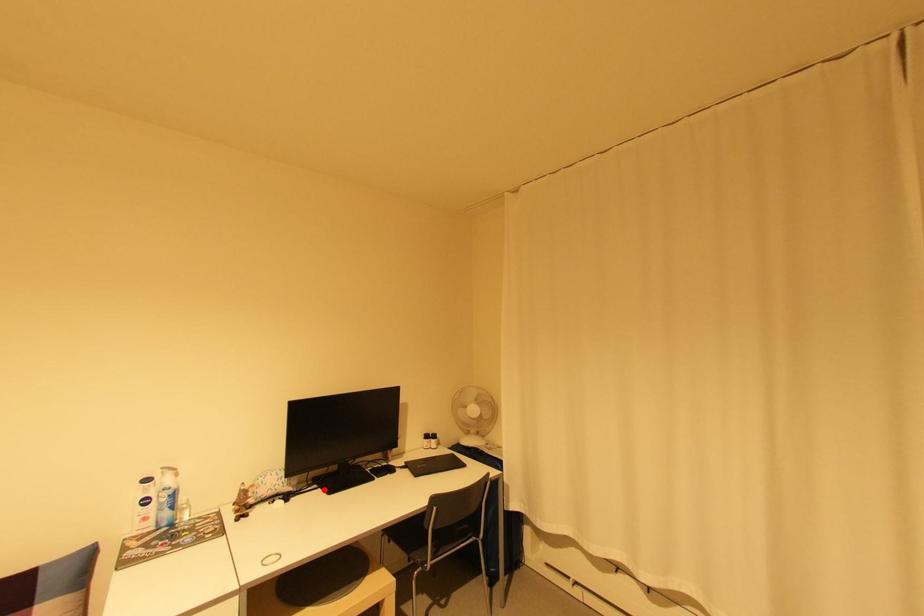
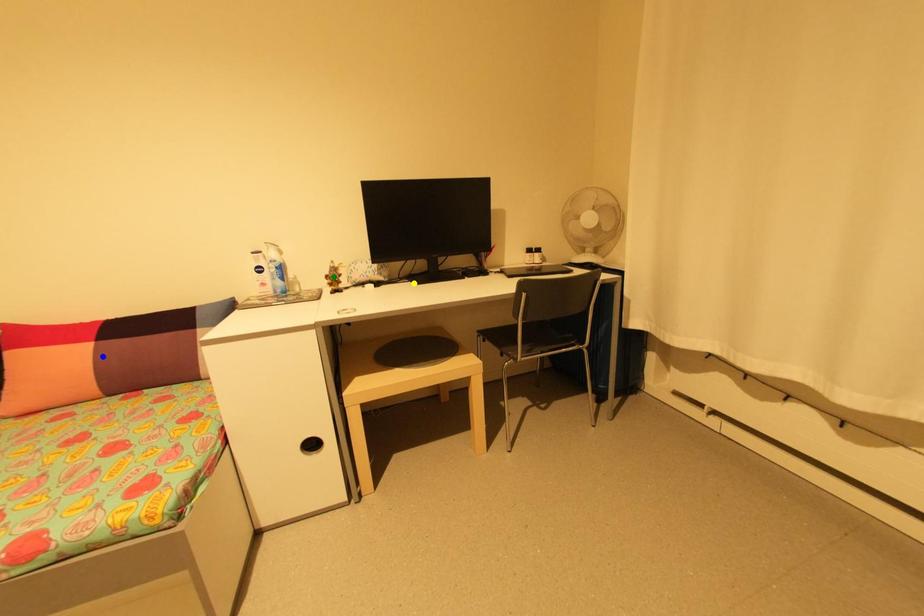
Question: I am providing you with two images of the same scene from different viewpoints. A red point is marked on the first image. You are given multiple points on the second image. Can you choose the point in image 2 that corresponds to the point in image 1?

Choices:
 (A) yellow point
 (B) blue point
 (C) green point

Answer: (A)